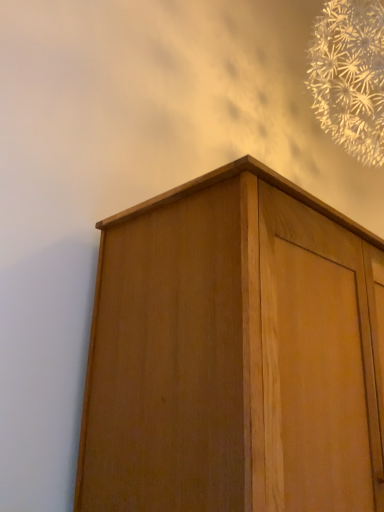
The height and width of the screenshot is (512, 384). What do you see at coordinates (234, 354) in the screenshot? I see `light brown wood cupboard at center` at bounding box center [234, 354].

Find the location of a particular element. The height and width of the screenshot is (512, 384). light brown wood cupboard at center is located at coordinates (234, 354).

Find the location of `light brown wood cupboard at center`. light brown wood cupboard at center is located at coordinates (234, 354).